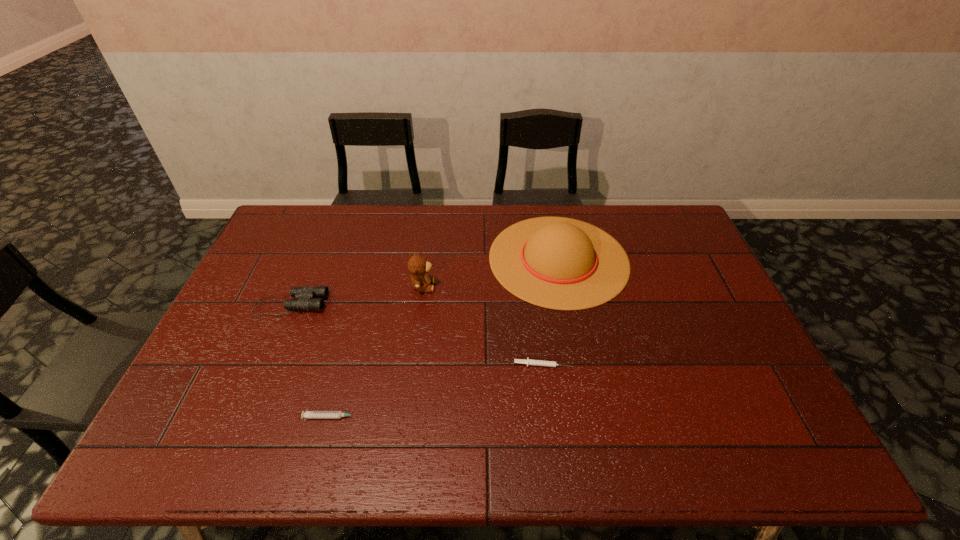
This screenshot has height=540, width=960. I want to click on vacant space located at the eyepiece of the binoculars, so click(x=376, y=305).

I want to click on free space located 0.070m at the needle end of the taller syringe, so click(x=391, y=417).

Identify the location of vacant space located 0.390m on the right of the shortest object. Image resolution: width=960 pixels, height=540 pixels. (718, 364).

In order to click on object present at the far edge in this screenshot , I will do `click(559, 263)`.

Identify the location of object positioned at the left edge. pyautogui.click(x=304, y=299).

Find the location of `vacant space at the far edge`. vacant space at the far edge is located at coordinates (491, 207).

Identify the location of vacant space at the left edge of the desktop. The width and height of the screenshot is (960, 540). (300, 265).

The height and width of the screenshot is (540, 960). Identify the location of vacant space at the far left corner of the desktop. (287, 219).

At what (x,y) coordinates should I click in order to perform the action: click on vacant area at the near left corner. Please return your answer as a coordinate pair (x, y). Looking at the image, I should click on (153, 450).

At what (x,y) coordinates should I click in order to perform the action: click on vacant space at the far right corner. Please return your answer as a coordinate pair (x, y). This screenshot has height=540, width=960. Looking at the image, I should click on (650, 224).